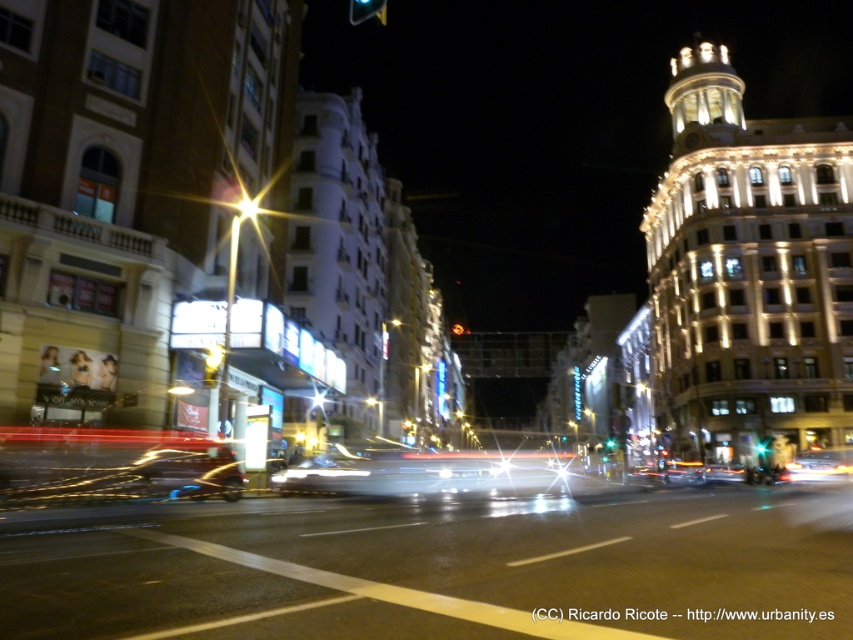
You are a pedestrian looking at the street from across the road. You notice the amber glass traffic light at upper center and the bright metallic streetlight at upper center. Which one is positioned to the left side from your viewpoint?

The amber glass traffic light at upper center is positioned to the left of the bright metallic streetlight at upper center, so it is the one on the left side from your viewpoint.